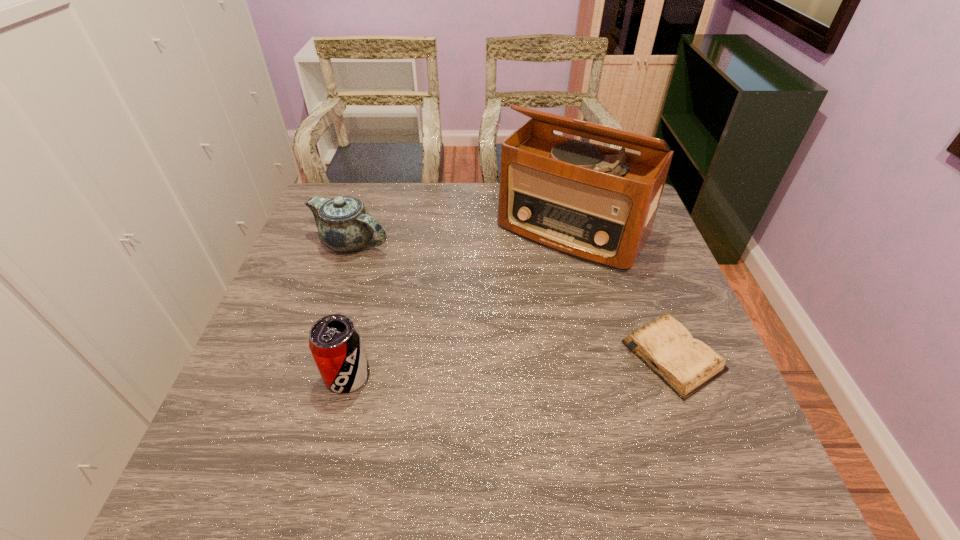
Find the location of `free space on the desktop that is between the soda can and the shortest object and is positioned on the front panel of the tallest object`. free space on the desktop that is between the soda can and the shortest object and is positioned on the front panel of the tallest object is located at coordinates (471, 368).

Where is `free space on the desktop that is between the soda can and the shortest object and is positioned from the spout of the chinaware`? The image size is (960, 540). free space on the desktop that is between the soda can and the shortest object and is positioned from the spout of the chinaware is located at coordinates (504, 367).